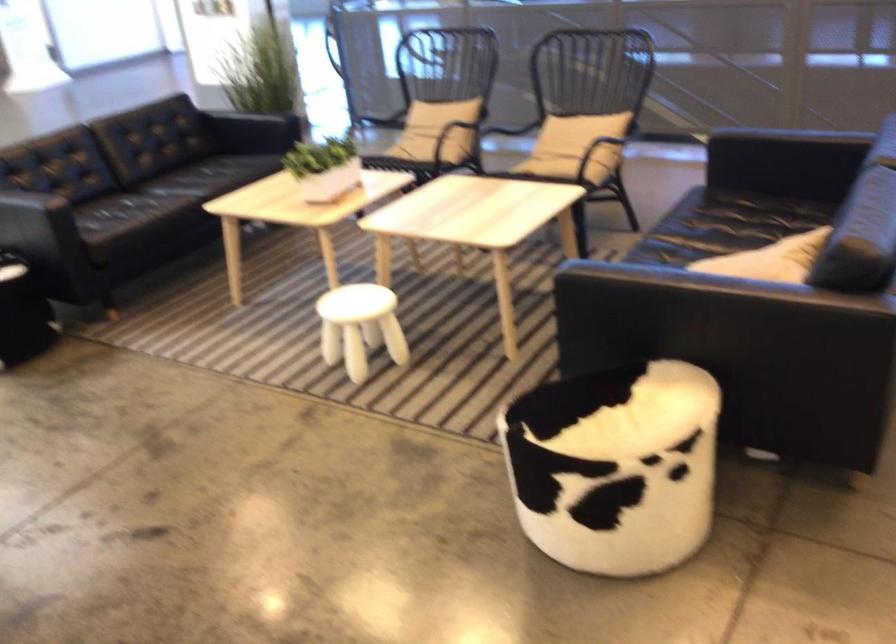
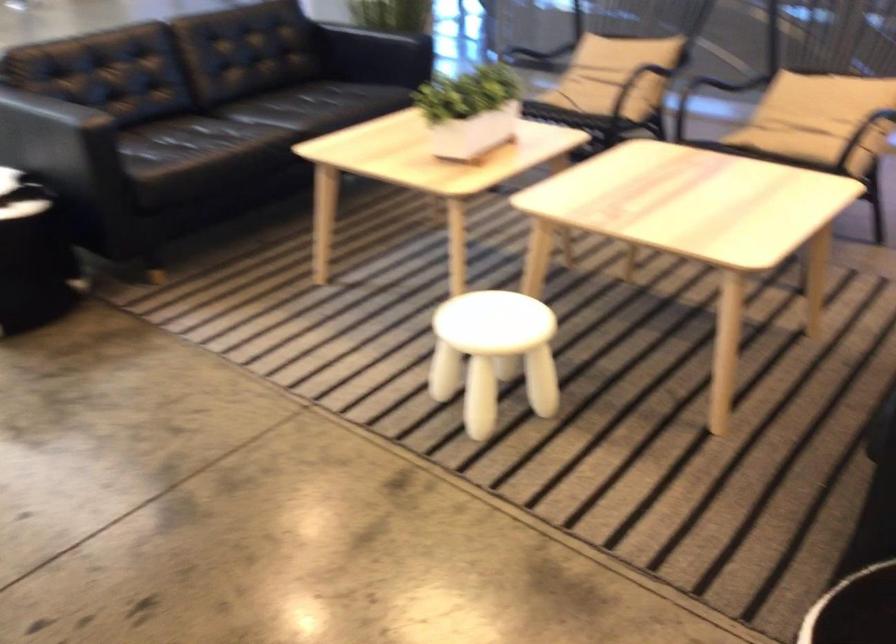
In the second image, find the point that corresponds to (x=363, y=323) in the first image.

(493, 354)